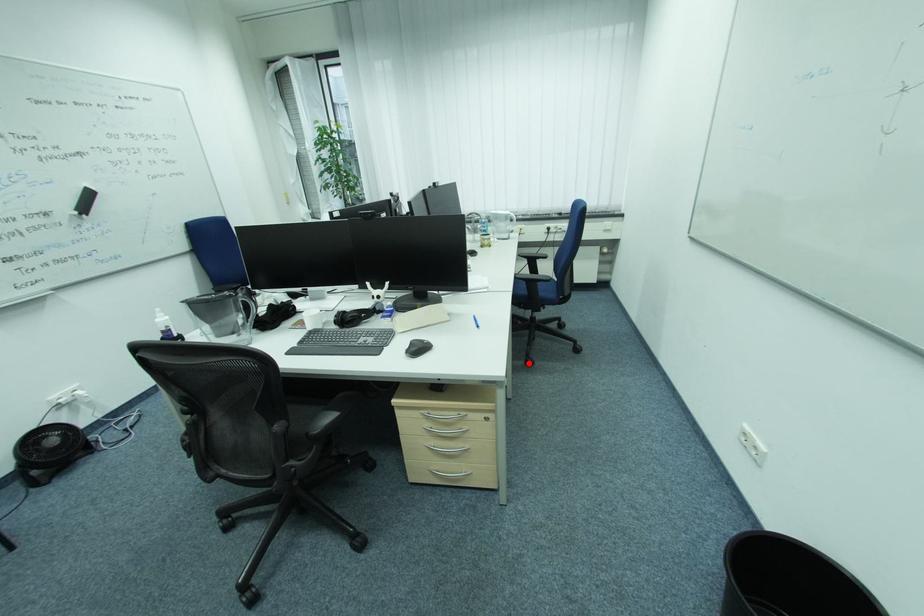
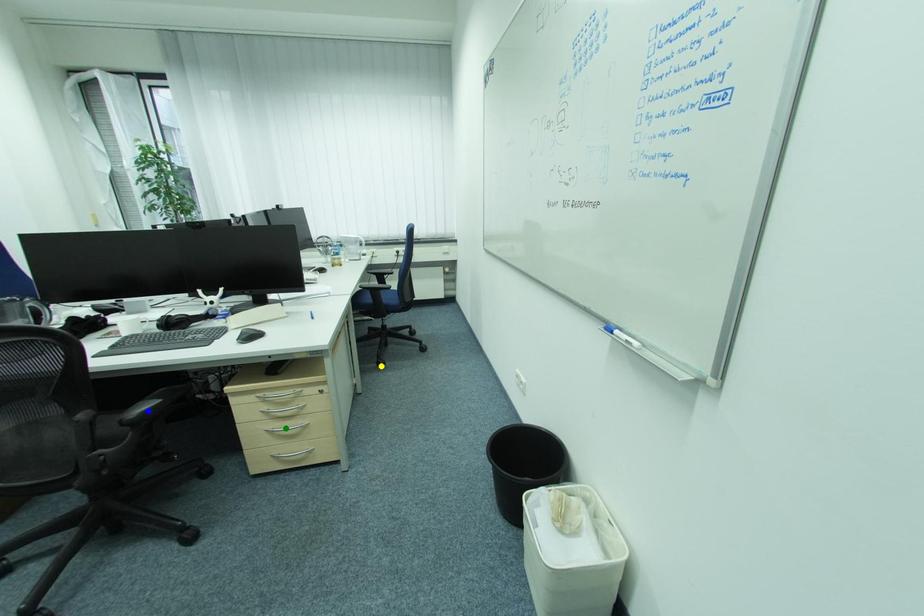
Question: I am providing you with two images of the same scene from different viewpoints. A red point is marked on the first image. You are given multiple points on the second image. Which point in image 2 is actually the same real-world point as the red point in image 1?

Choices:
 (A) yellow point
 (B) blue point
 (C) green point

Answer: (A)